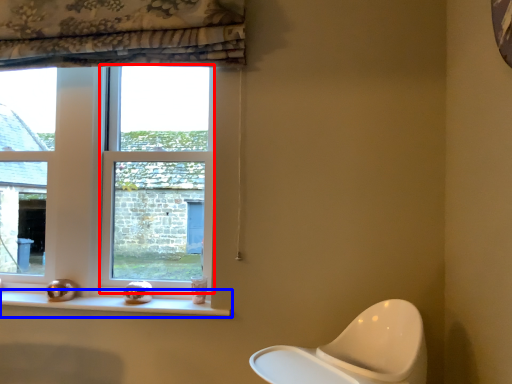
Question: Among these objects, which one is nearest to the camera, window (highlighted by a red box) or window sill (highlighted by a blue box)?

Choices:
 (A) window
 (B) window sill

Answer: (B)